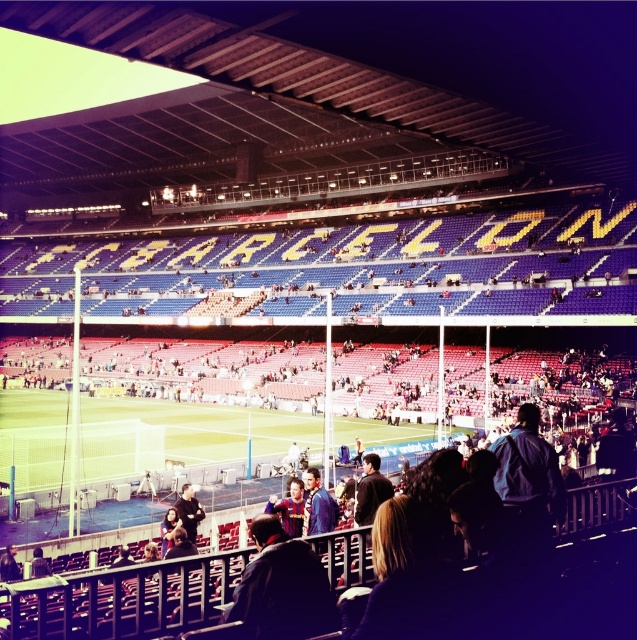
You are a photographer at the stadium and want to capture both the blue fabric jacket at center and the dark blue jacket at lower center in a single shot. Which jacket would appear thinner in the photo?

The blue fabric jacket at center would appear thinner in the photo because it is thinner than the dark blue jacket at lower center according to the description.

You are a photographer standing at the edge of the field. You want to take a photo of the dark blue jacket at lower center without the blue fabric jacket at center blocking it. Is this possible?

The blue fabric jacket at center is in front of the dark blue jacket at lower center, so it would block the view. To capture the dark blue jacket at lower center without obstruction, you would need to reposition yourself or have the blue fabric jacket at center moved out of the way.

You are a photographer at the Barcelona stadium scene. You want to capture a photo of the blue fabric jacket at center. Where should you aim your camera to include the jacket in the frame?

The blue fabric jacket at center is located at the 2D coordinates point (317, 506), so aim your camera at those coordinates to capture the jacket in the frame.